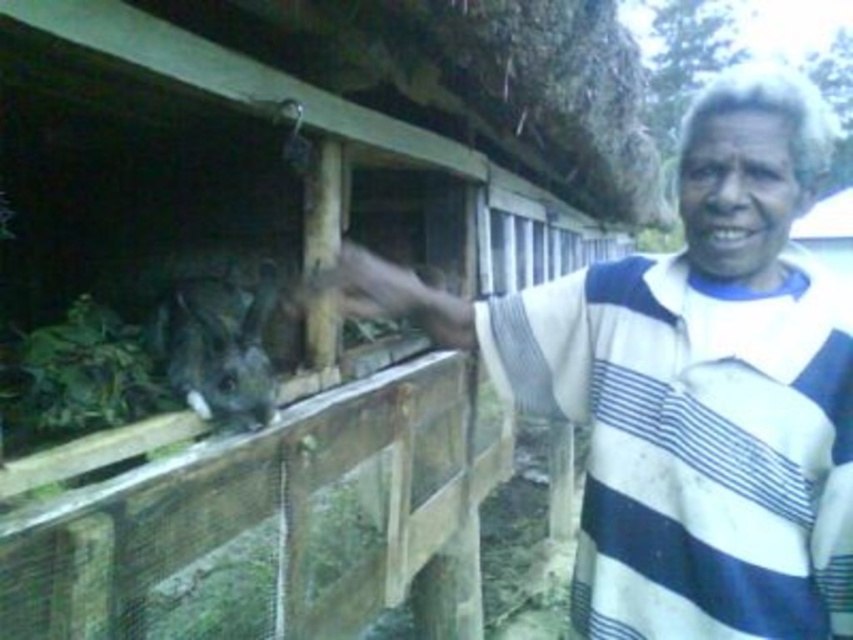
Question: Is white striped shirt at center above furry gray rabbit at center?

Choices:
 (A) yes
 (B) no

Answer: (B)

Question: Among these objects, which one is farthest from the camera?

Choices:
 (A) white striped shirt at center
 (B) furry gray rabbit at center

Answer: (B)

Question: In this image, where is white striped shirt at center located relative to furry gray rabbit at center?

Choices:
 (A) below
 (B) above

Answer: (A)

Question: Does white striped shirt at center appear over furry gray rabbit at center?

Choices:
 (A) no
 (B) yes

Answer: (A)

Question: Which object is farther from the camera taking this photo?

Choices:
 (A) white striped shirt at center
 (B) furry gray rabbit at center

Answer: (B)